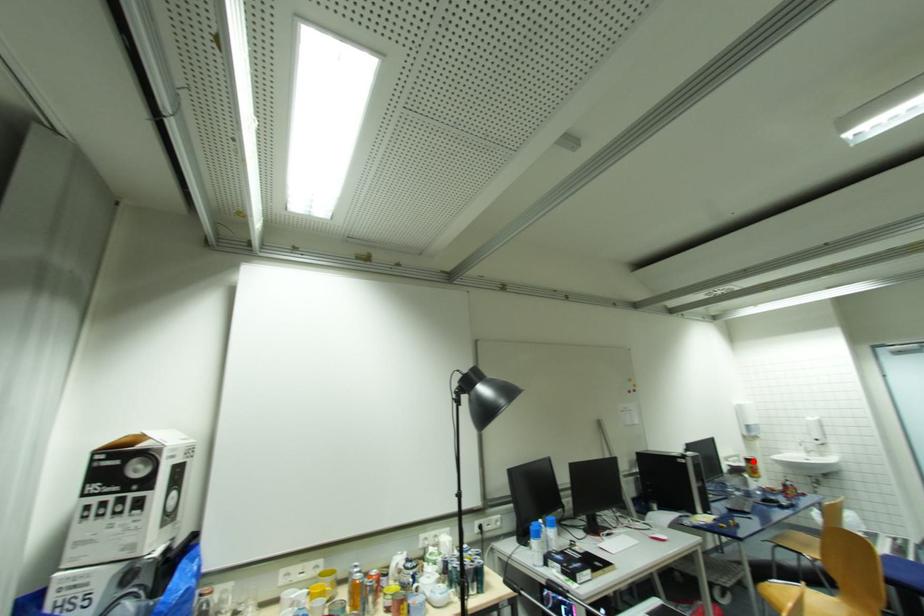
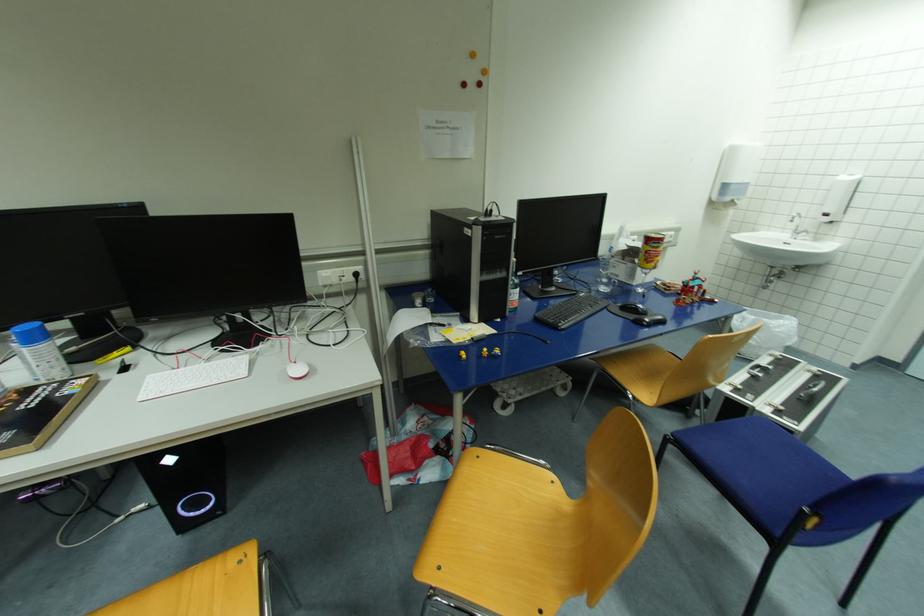
In the second image, find the point that corresponds to the highlighted location in the first image.

(653, 241)